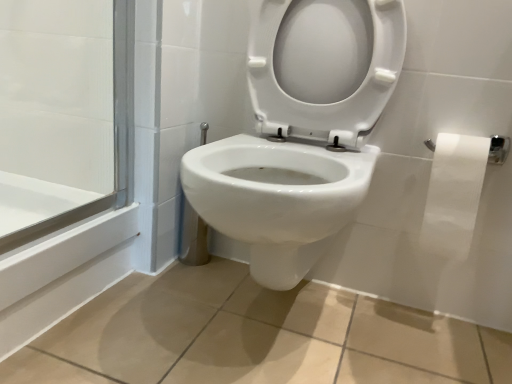
Identify the location of white glossy toilet at center. The width and height of the screenshot is (512, 384). (301, 131).

What do you see at coordinates (301, 131) in the screenshot?
I see `white glossy toilet at center` at bounding box center [301, 131].

What is the approximate width of white glossy toilet at center?

white glossy toilet at center is 20.63 inches wide.

What is the approximate width of white paper at right?

12.23 centimeters.

Locate an element on the screen. Image resolution: width=512 pixels, height=384 pixels. white paper at right is located at coordinates 454,194.

The height and width of the screenshot is (384, 512). Describe the element at coordinates (454, 194) in the screenshot. I see `white paper at right` at that location.

You are a GUI agent. You are given a task and a screenshot of the screen. Output one action in this format:
    pyautogui.click(x=<x>, y=<y>)
    Task: Click on the white glossy toilet at center
    
    Given the screenshot: What is the action you would take?
    pyautogui.click(x=301, y=131)

Considering the relative positions of white glossy toilet at center and white paper at right in the image provided, is white glossy toilet at center to the right of white paper at right from the viewer's perspective?

No.

Considering their positions, is white glossy toilet at center located in front of or behind white paper at right?

In the image, white glossy toilet at center appears in front of white paper at right.

Does point (355, 3) lie in front of point (438, 231)?

That is False.

From the image's perspective, is white glossy toilet at center beneath white paper at right?

Actually, white glossy toilet at center appears above white paper at right in the image.

From a real-world perspective, is white glossy toilet at center positioned above or below white paper at right?

Clearly, from a real-world perspective, white glossy toilet at center is above white paper at right.

Which of these two, white glossy toilet at center or white paper at right, is wider?

white glossy toilet at center.

Considering the sizes of objects white glossy toilet at center and white paper at right in the image provided, who is shorter, white glossy toilet at center or white paper at right?

With less height is white paper at right.

Is white glossy toilet at center smaller than white paper at right?

Actually, white glossy toilet at center might be larger than white paper at right.

Looking at this image, is white paper at right located within white glossy toilet at center?

No, white paper at right is not surrounded by white glossy toilet at center.

Are white glossy toilet at center and white paper at right far apart?

white glossy toilet at center is actually quite close to white paper at right.

Does white glossy toilet at center turn towards white paper at right?

No.

How different are the orientations of white glossy toilet at center and white paper at right in degrees?

There is a 0.224-degree angle between the facing directions of white glossy toilet at center and white paper at right.

Where is `toilet paper on the right of white glossy toilet at center`? The height and width of the screenshot is (384, 512). toilet paper on the right of white glossy toilet at center is located at coordinates (454, 194).

Is white paper at right to the left of white glossy toilet at center from the viewer's perspective?

No, white paper at right is not to the left of white glossy toilet at center.

Is white paper at right in front of or behind white glossy toilet at center in the image?

In the image, white paper at right appears behind white glossy toilet at center.

Between point (460, 212) and point (196, 191), which one is positioned in front?

The point (196, 191) is closer.

From the image's perspective, relative to white glossy toilet at center, is white paper at right above or below?

white paper at right is situated lower than white glossy toilet at center in the image.

From a real-world perspective, is white paper at right physically located above or below white glossy toilet at center?

Clearly, from a real-world perspective, white paper at right is below white glossy toilet at center.

Is white paper at right wider or thinner than white glossy toilet at center?

Considering their sizes, white paper at right looks slimmer than white glossy toilet at center.

Which of these two, white paper at right or white glossy toilet at center, stands shorter?

white paper at right.

In terms of size, does white paper at right appear bigger or smaller than white glossy toilet at center?

white paper at right is smaller than white glossy toilet at center.

Is white paper at right inside or outside of white glossy toilet at center?

The correct answer is: outside.

Is white paper at right touching white glossy toilet at center?

No, white paper at right is not in contact with white glossy toilet at center.

Does white paper at right turn towards white glossy toilet at center?

No, white paper at right is not turned towards white glossy toilet at center.

From the picture: How many degrees apart are the facing directions of white paper at right and white glossy toilet at center?

white paper at right and white glossy toilet at center are facing 0.224 degrees away from each other.

Where is `toilet paper that is below the white glossy toilet at center (from the image's perspective)`? The height and width of the screenshot is (384, 512). toilet paper that is below the white glossy toilet at center (from the image's perspective) is located at coordinates tap(454, 194).

This screenshot has width=512, height=384. In order to click on toilet above the white paper at right (from the image's perspective) in this screenshot , I will do `click(301, 131)`.

The image size is (512, 384). Find the location of `toilet paper that is on the right side of white glossy toilet at center`. toilet paper that is on the right side of white glossy toilet at center is located at coordinates (454, 194).